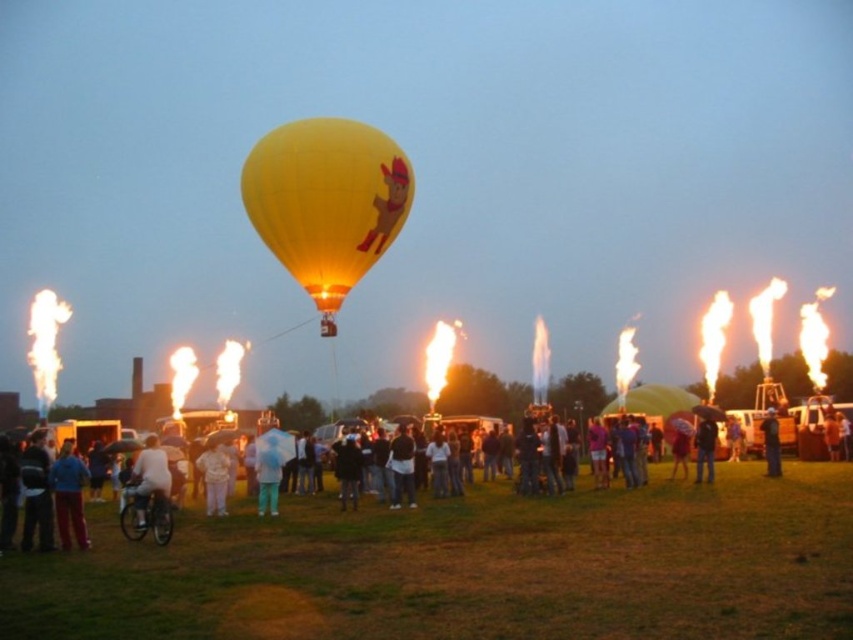
Question: Can you confirm if white cotton shirt at center is bigger than white matte shirt at center?

Choices:
 (A) no
 (B) yes

Answer: (B)

Question: Can you confirm if light blue fabric umbrella at center is thinner than blue fabric umbrella at center?

Choices:
 (A) no
 (B) yes

Answer: (B)

Question: Which point is farther to the camera?

Choices:
 (A) yellow matte hot air balloon at center
 (B) blue fabric umbrella at center

Answer: (B)

Question: In this image, where is blue fabric jacket at lower left located relative to white matte shirt at center?

Choices:
 (A) above
 (B) below

Answer: (A)

Question: Which object is positioned farthest from the light blue fabric umbrella at center?

Choices:
 (A) blue fabric jacket at lower left
 (B) white matte shirt at center
 (C) blue fabric umbrella at center
 (D) white cotton shirt at center

Answer: (A)

Question: Among these points, which one is farthest from the camera?

Choices:
 (A) (144, 456)
 (B) (68, 442)
 (C) (399, 177)
 (D) (369, 532)

Answer: (C)